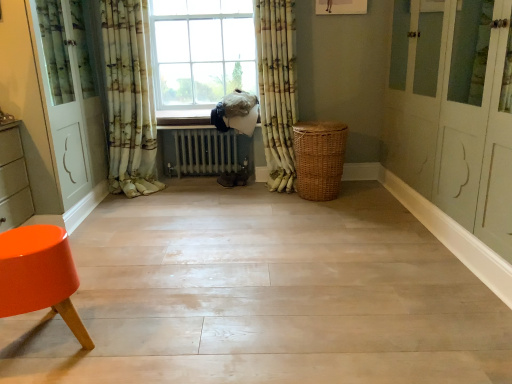
Question: Would you say green floral fabric curtain at left, marked as the 1th curtain in a left-to-right arrangement, is inside or outside patterned fabric curtain at center, which is counted as the 1th curtain, starting from the right?

Choices:
 (A) inside
 (B) outside

Answer: (B)

Question: From a real-world perspective, is green floral fabric curtain at left, marked as the 1th curtain in a left-to-right arrangement, positioned above or below patterned fabric curtain at center, acting as the third curtain starting from the left?

Choices:
 (A) above
 (B) below

Answer: (A)

Question: Which object is the farthest from the patterned fabric curtain at center, which is counted as the 1th curtain, starting from the right?

Choices:
 (A) floral fabric curtain at center, acting as the second curtain starting from the right
 (B) white metallic radiator at center
 (C) wooden at center
 (D) orange glossy stool at lower left
 (E) woven brown basket at center

Answer: (D)

Question: Estimate the real-world distances between objects in this image. Which object is farther from the patterned fabric curtain at center, which is counted as the 1th curtain, starting from the right?

Choices:
 (A) floral fabric curtain at center, which is counted as the second curtain, starting from the left
 (B) woven brown basket at center
 (C) green floral fabric curtain at left, which appears as the 3th curtain when viewed from the right
 (D) white metallic radiator at center
 (E) orange glossy stool at lower left

Answer: (E)